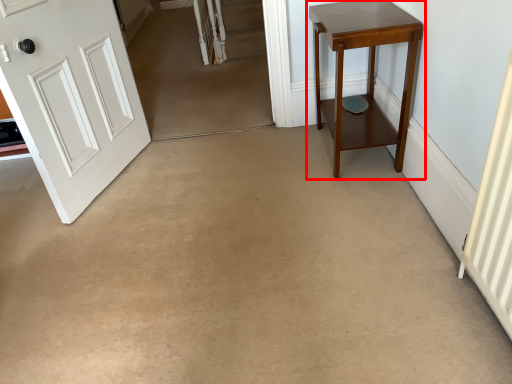
Question: From the image's perspective, where is table (annotated by the red box) located in relation to door in the image?

Choices:
 (A) above
 (B) below

Answer: (A)